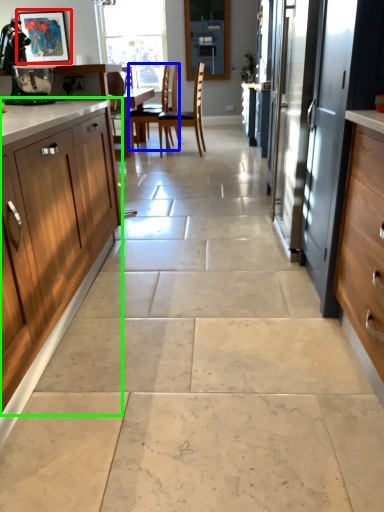
Question: Estimate the real-world distances between objects in this image. Which object is farther from picture frame (highlighted by a red box), chair (highlighted by a blue box) or cabinetry (highlighted by a green box)?

Choices:
 (A) chair
 (B) cabinetry

Answer: (A)